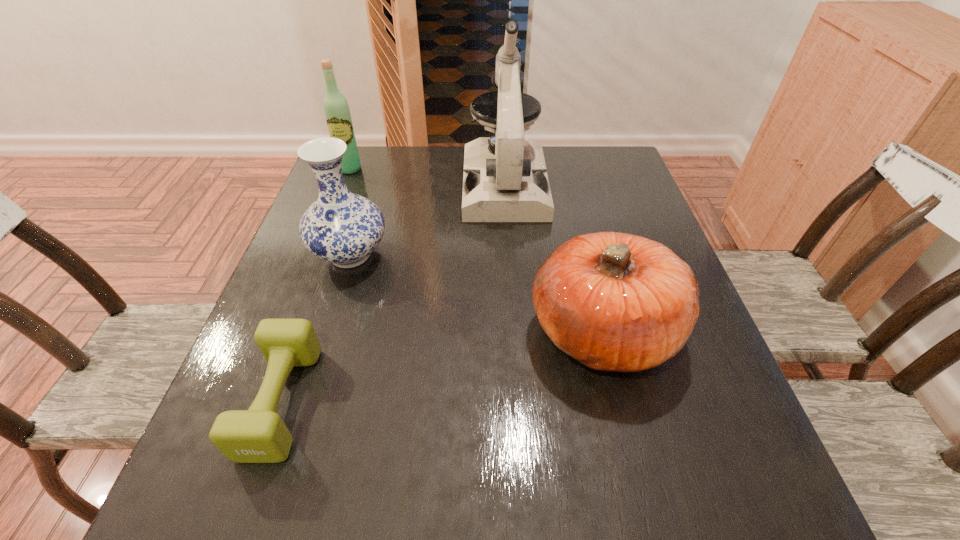
At what (x,y) coordinates should I click in order to perform the action: click on microscope that is at the far edge. Please return your answer as a coordinate pair (x, y). Looking at the image, I should click on (505, 179).

Locate an element on the screen. This screenshot has height=540, width=960. wine bottle at the far edge is located at coordinates (336, 109).

The width and height of the screenshot is (960, 540). I want to click on wine bottle located in the left edge section of the desktop, so click(336, 109).

Image resolution: width=960 pixels, height=540 pixels. I want to click on vase at the left edge, so click(x=340, y=227).

Locate an element on the screen. The width and height of the screenshot is (960, 540). dumbbell present at the left edge is located at coordinates click(258, 435).

Where is `object situated at the right edge`? object situated at the right edge is located at coordinates (613, 301).

At what (x,y) coordinates should I click in order to perform the action: click on object that is at the far left corner. Please return your answer as a coordinate pair (x, y). The height and width of the screenshot is (540, 960). Looking at the image, I should click on (336, 109).

This screenshot has height=540, width=960. Find the location of `blank space at the far edge of the desktop`. blank space at the far edge of the desktop is located at coordinates (406, 174).

Identify the location of vacant space at the near edge. (656, 487).

In the image, there is a desktop. Where is `vacant space at the left edge`? This screenshot has height=540, width=960. vacant space at the left edge is located at coordinates (330, 310).